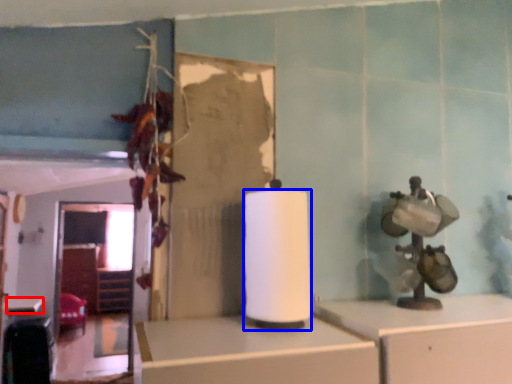
Question: Which object appears farthest to the camera in this image, table (highlighted by a red box) or paper towel (highlighted by a blue box)?

Choices:
 (A) table
 (B) paper towel

Answer: (A)